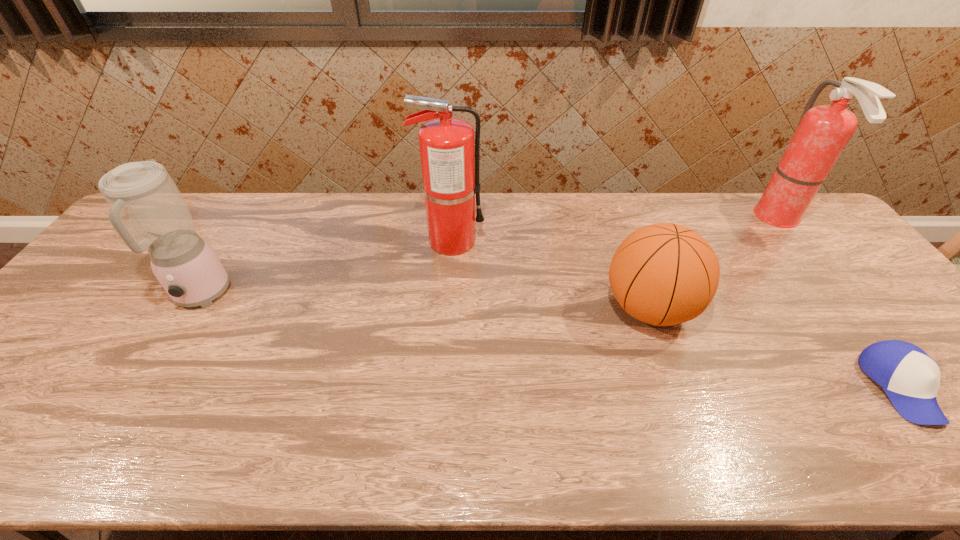
Identify which object is located as the nearest to the right fire extinguisher. Please provide its 2D coordinates. Your answer should be formatted as a tuple, i.e. [(x, y)], where the tuple contains the x and y coordinates of a point satisfying the conditions above.

[(664, 274)]

Locate an element on the screen. object that is the fourth closest to the nearest object is located at coordinates (147, 210).

Where is `vacant space that satisfies the following two spatial constraints: 1. at the nozzle of the fourth object from right to left; 2. on the base of the food processor near the control knob`? vacant space that satisfies the following two spatial constraints: 1. at the nozzle of the fourth object from right to left; 2. on the base of the food processor near the control knob is located at coordinates (447, 296).

Where is `free location that satisfies the following two spatial constraints: 1. at the nozzle of the left fire extinguisher; 2. on the base of the third tallest object near the control knob`? The height and width of the screenshot is (540, 960). free location that satisfies the following two spatial constraints: 1. at the nozzle of the left fire extinguisher; 2. on the base of the third tallest object near the control knob is located at coordinates (447, 296).

At what (x,y) coordinates should I click in order to perform the action: click on blank area in the image that satisfies the following two spatial constraints: 1. with the handle and hose on the right fire extinguisher; 2. on the base of the third shortest object near the control knob. Please return your answer as a coordinate pair (x, y). The image size is (960, 540). Looking at the image, I should click on (840, 296).

Locate an element on the screen. The image size is (960, 540). free location that satisfies the following two spatial constraints: 1. on the base of the third object from left to right near the control knob; 2. on the left side of the leftmost object is located at coordinates (193, 308).

Identify the location of vacant space that satisfies the following two spatial constraints: 1. with the handle and hose on the right fire extinguisher; 2. on the front side of the third object from right to left. (850, 308).

Find the location of a particular element. free region that satisfies the following two spatial constraints: 1. on the base of the food processor near the control knob; 2. on the right side of the fourth tallest object is located at coordinates (193, 308).